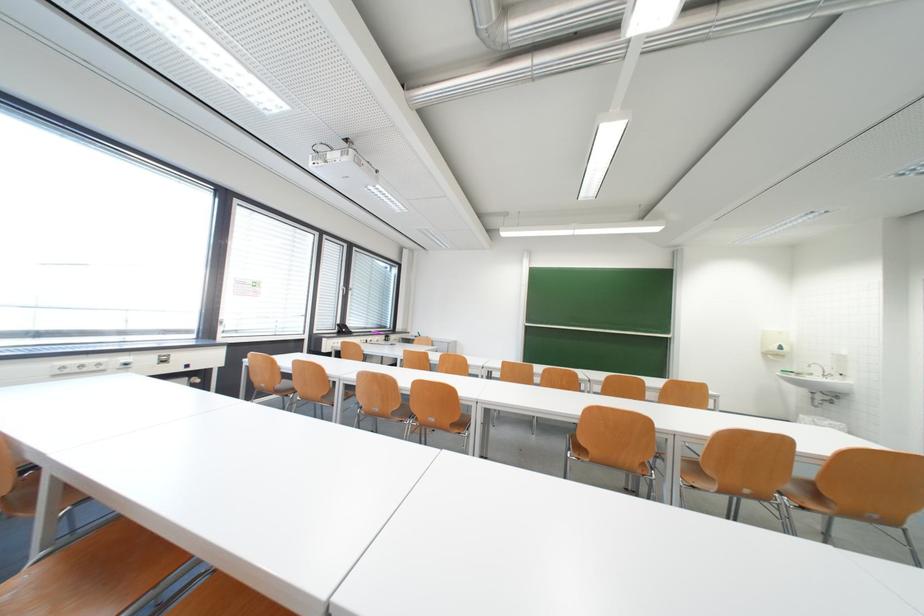
The height and width of the screenshot is (616, 924). I want to click on USB port, so click(187, 366).